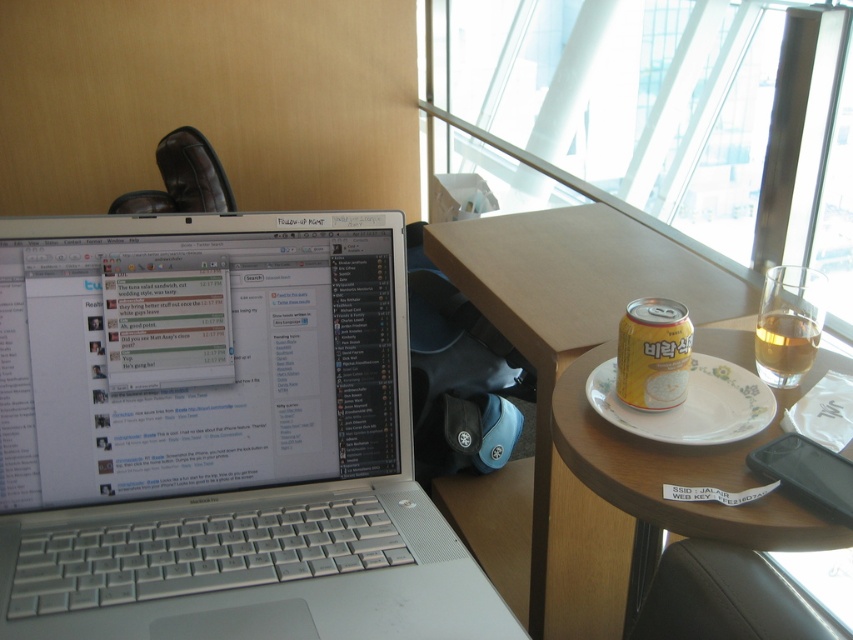
Between transparent glass window at upper center and wooden table at center, which one appears on the right side from the viewer's perspective?

Positioned to the right is transparent glass window at upper center.

Does transparent glass window at upper center have a lesser height compared to wooden table at center?

In fact, transparent glass window at upper center may be taller than wooden table at center.

Does point (602, 65) come behind point (460, 225)?

That is True.

Identify the location of transparent glass window at upper center. (674, 112).

Is transparent glass window at upper center below yellow matte can at right?

Incorrect, transparent glass window at upper center is not positioned below yellow matte can at right.

How distant is transparent glass window at upper center from yellow matte can at right?

transparent glass window at upper center and yellow matte can at right are 1.88 meters apart from each other.

The image size is (853, 640). In order to click on transparent glass window at upper center in this screenshot , I will do `click(674, 112)`.

The width and height of the screenshot is (853, 640). In order to click on transparent glass window at upper center in this screenshot , I will do `click(674, 112)`.

Is silver metallic laptop at center to the right of transparent glass window at upper center from the viewer's perspective?

Incorrect, silver metallic laptop at center is not on the right side of transparent glass window at upper center.

Is silver metallic laptop at center further to camera compared to transparent glass window at upper center?

No, it is not.

Is point (164, 532) positioned in front of point (637, 200)?

Yes.

Find the location of a particular element. The image size is (853, 640). silver metallic laptop at center is located at coordinates (218, 435).